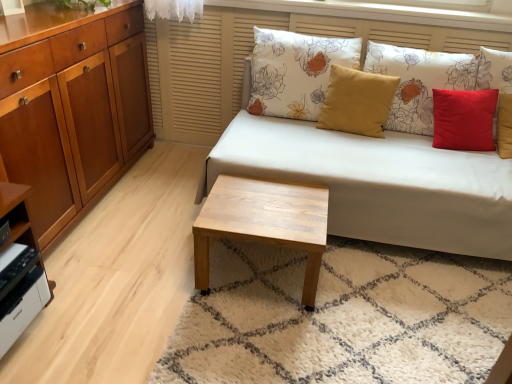
Question: Could you tell me if white matte printer at lower left is facing matte yellow pillow at center, which is counted as the 2th pillow, starting from the right?

Choices:
 (A) no
 (B) yes

Answer: (A)

Question: Considering the relative sizes of white matte printer at lower left and matte yellow pillow at center, the second pillow when ordered from left to right, in the image provided, is white matte printer at lower left taller than matte yellow pillow at center, the second pillow when ordered from left to right,?

Choices:
 (A) no
 (B) yes

Answer: (A)

Question: From a real-world perspective, is white matte printer at lower left located beneath matte yellow pillow at center, which is counted as the 2th pillow, starting from the right?

Choices:
 (A) yes
 (B) no

Answer: (A)

Question: From the image's perspective, is white matte printer at lower left beneath matte yellow pillow at center, the second pillow when ordered from left to right?

Choices:
 (A) yes
 (B) no

Answer: (A)

Question: From a real-world perspective, is white matte printer at lower left positioned over matte yellow pillow at center, which is counted as the 2th pillow, starting from the right, based on gravity?

Choices:
 (A) no
 (B) yes

Answer: (A)

Question: Is point (294, 188) positioned closer to the camera than point (387, 44)?

Choices:
 (A) closer
 (B) farther

Answer: (A)

Question: From a real-world perspective, is light wood/texture coffee table at center positioned above or below red matte pillow at upper right, which ranks as the 3th pillow in left-to-right order?

Choices:
 (A) below
 (B) above

Answer: (A)

Question: Looking at the image, does light wood/texture coffee table at center seem bigger or smaller compared to red matte pillow at upper right, marked as the first pillow in a right-to-left arrangement?

Choices:
 (A) small
 (B) big

Answer: (A)

Question: Is light wood/texture coffee table at center in front of or behind red matte pillow at upper right, marked as the first pillow in a right-to-left arrangement, in the image?

Choices:
 (A) behind
 (B) front

Answer: (B)

Question: From a real-world perspective, is red matte pillow at upper right, marked as the first pillow in a right-to-left arrangement, physically located above or below white fabric couch at center?

Choices:
 (A) below
 (B) above

Answer: (B)

Question: Visually, is red matte pillow at upper right, marked as the first pillow in a right-to-left arrangement, positioned to the left or to the right of white fabric couch at center?

Choices:
 (A) left
 (B) right

Answer: (B)

Question: From their relative heights in the image, would you say red matte pillow at upper right, marked as the first pillow in a right-to-left arrangement, is taller or shorter than white fabric couch at center?

Choices:
 (A) short
 (B) tall

Answer: (A)

Question: In terms of width, does red matte pillow at upper right, which ranks as the 3th pillow in left-to-right order, look wider or thinner when compared to white fabric couch at center?

Choices:
 (A) wide
 (B) thin

Answer: (B)

Question: Looking at the image, does matte yellow pillow at center, the second pillow when ordered from left to right, seem bigger or smaller compared to light wood/texture coffee table at center?

Choices:
 (A) small
 (B) big

Answer: (A)

Question: Visually, is matte yellow pillow at center, the second pillow when ordered from left to right, positioned to the left or to the right of light wood/texture coffee table at center?

Choices:
 (A) left
 (B) right

Answer: (B)